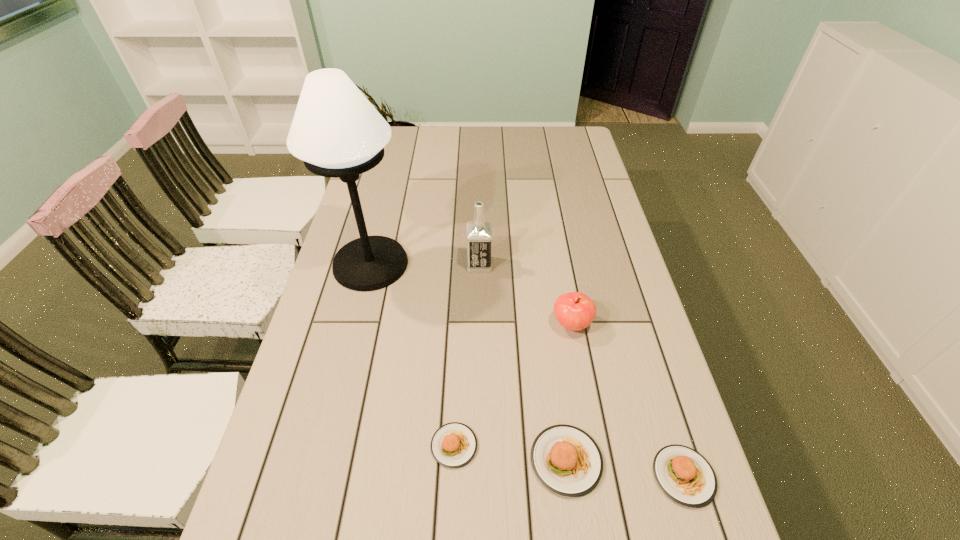
Image resolution: width=960 pixels, height=540 pixels. I want to click on free spot between the fifth shortest object and the tallest food, so click(x=522, y=362).

Locate an element on the screen. This screenshot has width=960, height=540. vacant area between the table lamp and the rightmost object is located at coordinates (527, 370).

Where is `vacant area that lies between the apple and the shortest object`? vacant area that lies between the apple and the shortest object is located at coordinates (513, 385).

This screenshot has width=960, height=540. Find the location of `free space between the fifth tallest object and the second food from right to left`. free space between the fifth tallest object and the second food from right to left is located at coordinates (625, 468).

Where is `free space between the fifth shortest object and the second food from left to right`? free space between the fifth shortest object and the second food from left to right is located at coordinates (522, 362).

You are a GUI agent. You are given a task and a screenshot of the screen. Output one action in this format:
    pyautogui.click(x=<x>, y=<y>)
    Task: Click on the vacant space that's between the rightmost food and the tallest food
    
    Given the screenshot: What is the action you would take?
    pyautogui.click(x=625, y=468)

Find the location of a particular element. object that is the nearest to the shortest object is located at coordinates pyautogui.click(x=566, y=460).

You are a GUI agent. You are given a task and a screenshot of the screen. Output one action in this format:
    pyautogui.click(x=<x>, y=<y>)
    Task: Click on the third closest object to the shortest object
    The image size is (960, 540).
    Given the screenshot: What is the action you would take?
    pyautogui.click(x=684, y=475)

In order to click on food identified as the closest to the second shortest object in this screenshot , I will do (x=566, y=460).

Identify which food is located as the nearest to the second food from right to left. Please provide its 2D coordinates. Your answer should be formatted as a tuple, i.e. [(x, y)], where the tuple contains the x and y coordinates of a point satisfying the conditions above.

[(684, 475)]